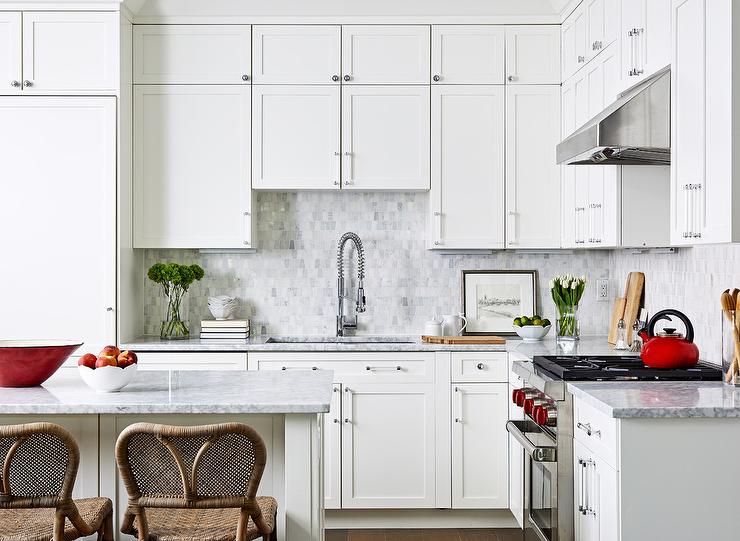
Find the location of a particular element. sink is located at coordinates (339, 335).